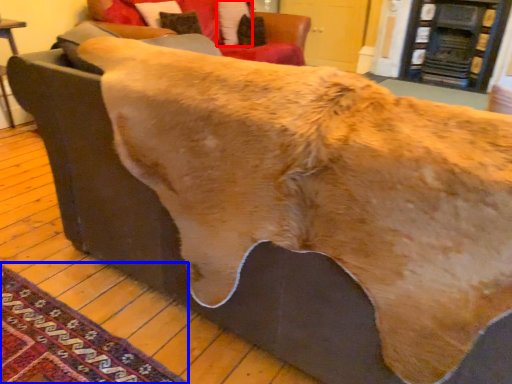
Question: Which object is further to the camera taking this photo, pillow (highlighted by a red box) or mat (highlighted by a blue box)?

Choices:
 (A) pillow
 (B) mat

Answer: (A)